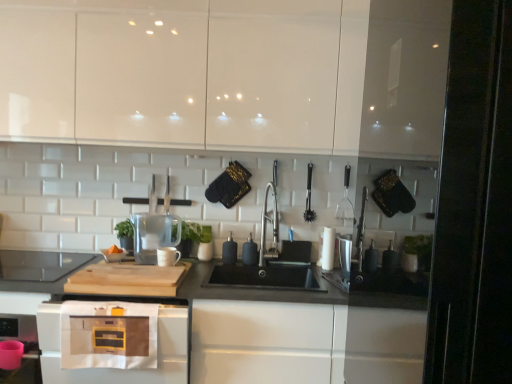
Locate an element on the screen. This screenshot has height=384, width=512. vacant space to the left of black matte soap dispenser at center, which appears as the third appliance when viewed from the left is located at coordinates (206, 262).